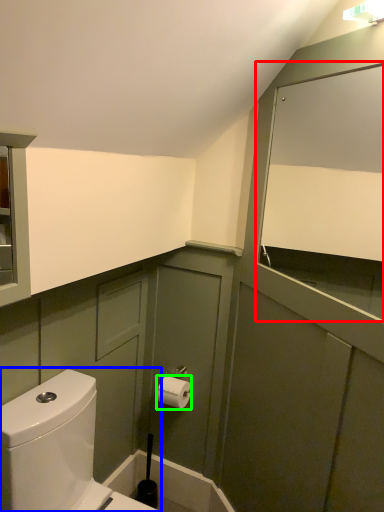
Question: Considering the real-world distances, which object is closest to mirror (highlighted by a red box)? toilet (highlighted by a blue box) or toiletry (highlighted by a green box).

Choices:
 (A) toilet
 (B) toiletry

Answer: (B)